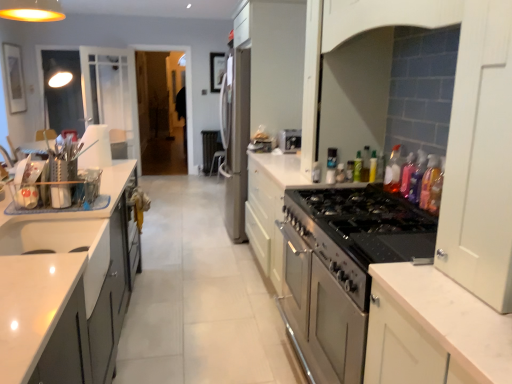
Question: Considering the positions of point (96, 226) and point (412, 193), is point (96, 226) closer or farther from the camera than point (412, 193)?

Choices:
 (A) farther
 (B) closer

Answer: (B)

Question: Looking at the image, does white glossy sink at lower left seem bigger or smaller compared to translucent plastic bottle at upper right, which is the sixth bottle in back-to-front order?

Choices:
 (A) small
 (B) big

Answer: (B)

Question: Estimate the real-world distances between objects in this image. Which object is closer to the translucent plastic bottle at upper right, the fifth bottle viewed from the front?

Choices:
 (A) pink glossy bottle at upper right, the 3th bottle from the front
 (B) satin silver toaster at center, the 2th appliance viewed from the right
 (C) satin silver refrigerator at center, arranged as the 3th appliance when viewed from the front
 (D) green plastic bottle at upper right, arranged as the 1th bottle when viewed from the back
 (E) translucent plastic bottle at upper right, which is the sixth bottle in back-to-front order

Answer: (D)

Question: Which is nearer to the translucent plastic bottle at stove top, which is the 4th bottle in front-to-back order?

Choices:
 (A) satin silver refrigerator at center, arranged as the first appliance when viewed from the left
 (B) white glossy sink at lower left
 (C) pink glossy bottle at upper right, the 3th bottle from the front
 (D) stainless steel oven at right, marked as the 1th appliance in a front-to-back arrangement
 (E) translucent plastic bottle at upper right, which appears as the 2th bottle when viewed from the front

Answer: (C)